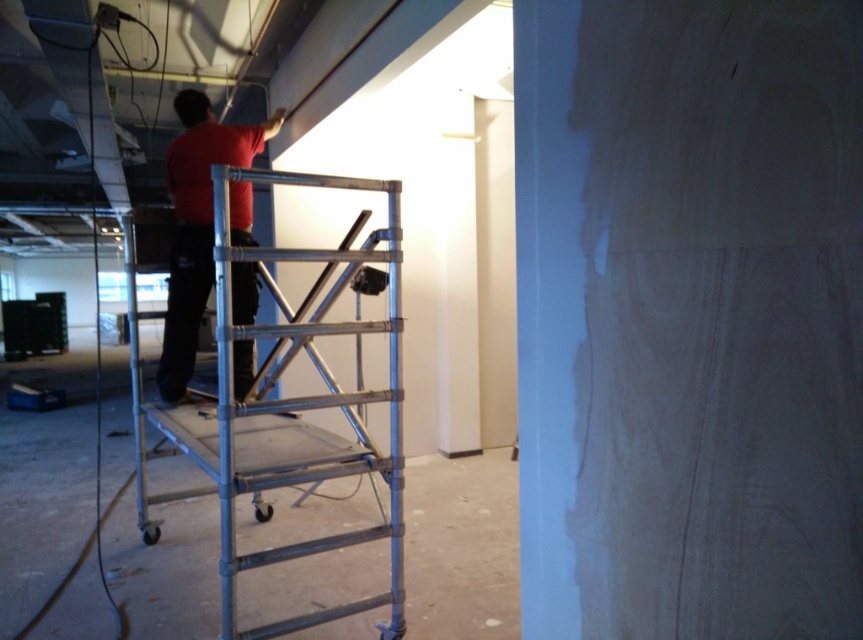
Does point (350, 259) lie in front of point (210, 220)?

Yes, it is in front of point (210, 220).

From the picture: Does silver metallic scaffolding at center appear on the right side of red matte shirt at upper center?

Yes, silver metallic scaffolding at center is to the right of red matte shirt at upper center.

Does point (319, 461) come in front of point (189, 188)?

Yes, it is in front of point (189, 188).

Find the location of a particular element. The image size is (863, 640). silver metallic scaffolding at center is located at coordinates (287, 406).